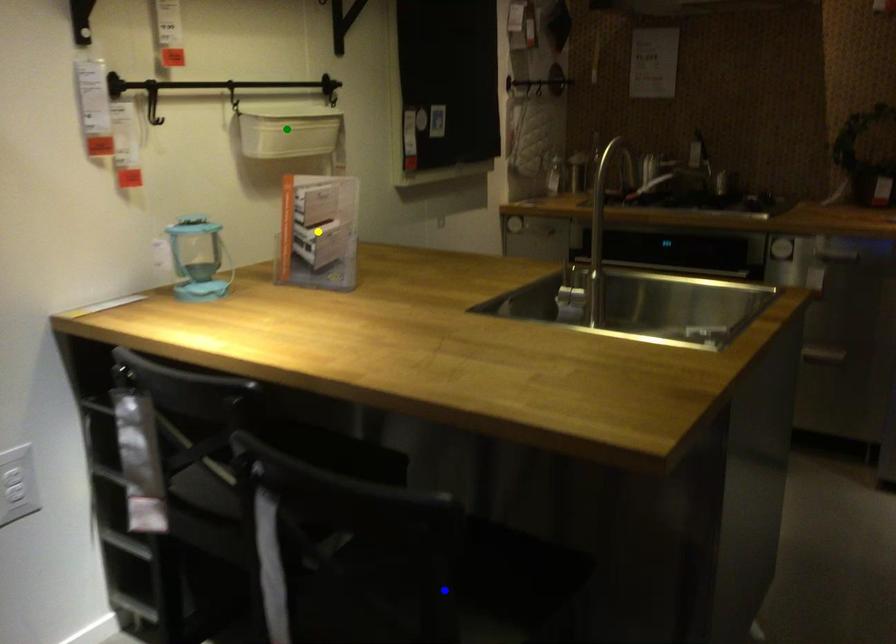
Order these from nearest to farthest:
blue point | green point | yellow point

green point
yellow point
blue point